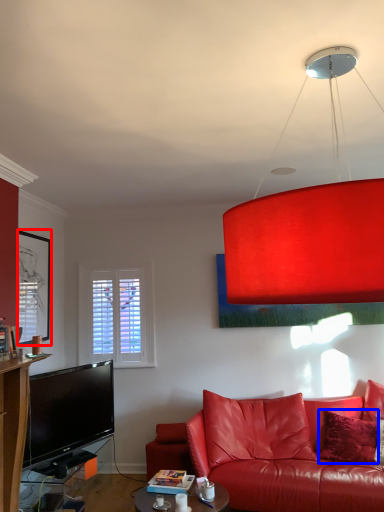
Question: Among these objects, which one is farthest to the camera, picture frame (highlighted by a red box) or pillow (highlighted by a blue box)?

Choices:
 (A) picture frame
 (B) pillow

Answer: (A)